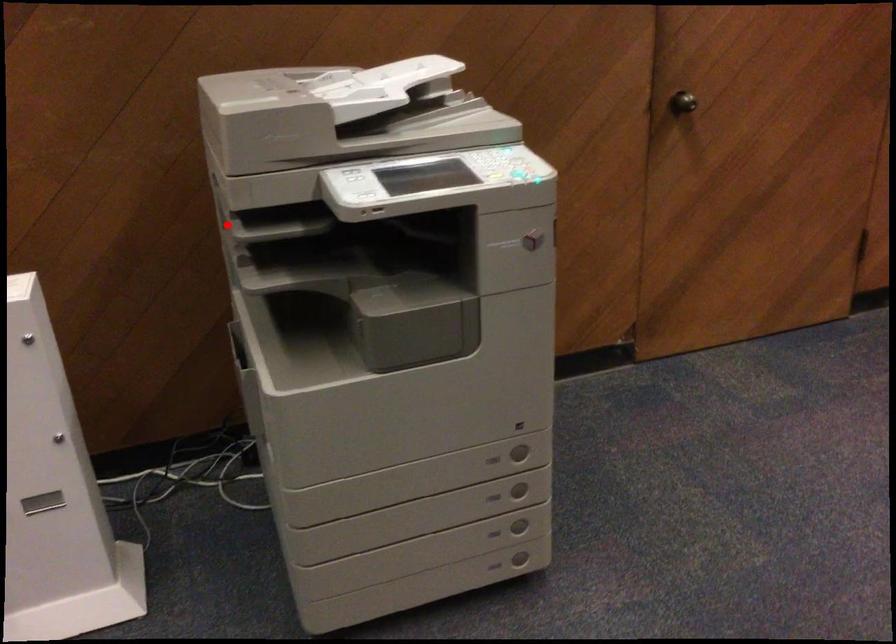
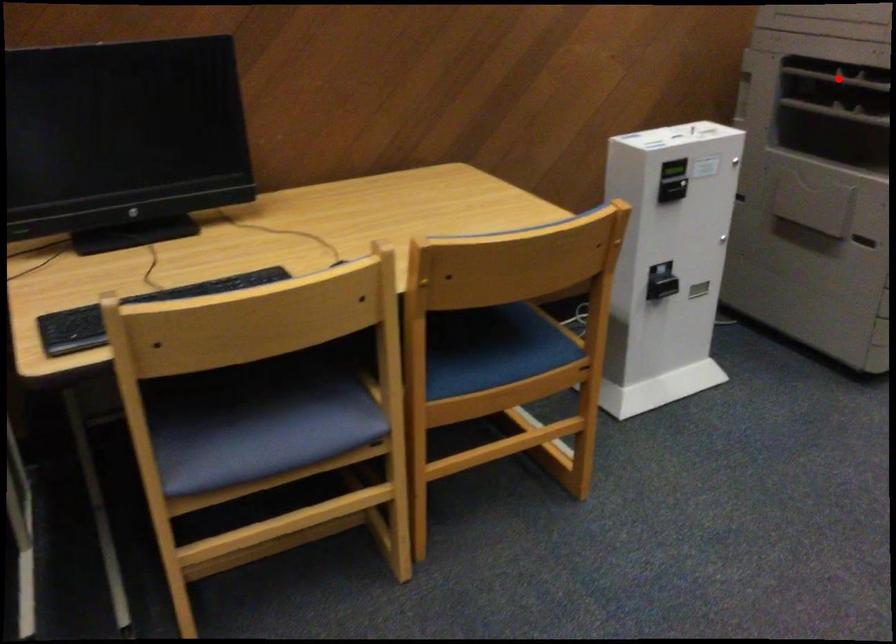
I am providing you with two images of the same scene from different viewpoints. A red point is marked on the first image and another point is marked on the second image. Does the point marked in image1 correspond to the same location as the one in image2?

Yes